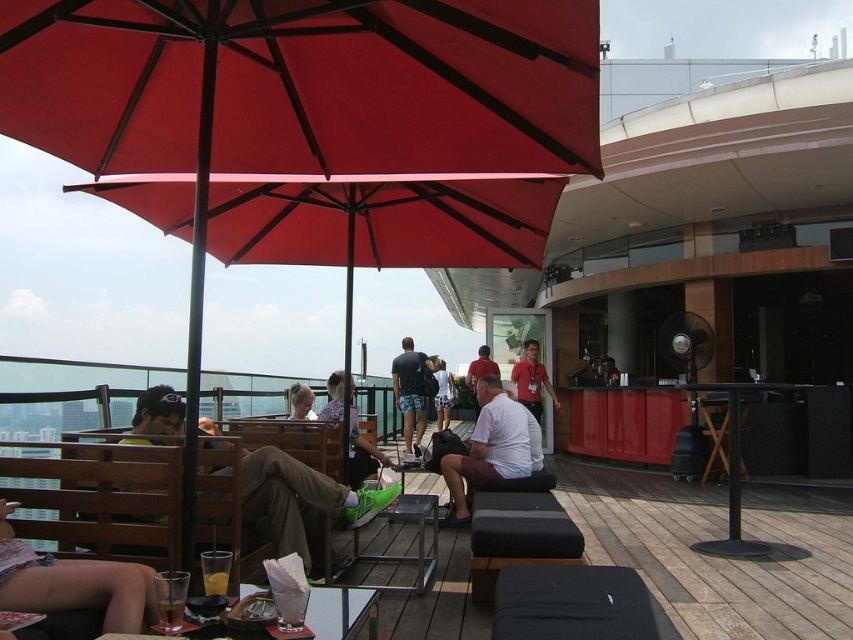
Identify the location of denim shorts at center. The height and width of the screenshot is (640, 853). (361, 451).

Does denim shorts at center have a lesser width compared to matte red shirt at center?

No, denim shorts at center is not thinner than matte red shirt at center.

Locate an element on the screen. denim shorts at center is located at coordinates (361, 451).

Is skinny jeans at lower left positioned behind red shirt at center?

No.

Looking at this image, between skinny jeans at lower left and red shirt at center, which one is positioned lower?

red shirt at center

What do you see at coordinates (73, 582) in the screenshot?
I see `skinny jeans at lower left` at bounding box center [73, 582].

Find the location of `skinny jeans at lower left`. skinny jeans at lower left is located at coordinates (73, 582).

Does white cotton shirt at center have a lesser height compared to matte red shirt at center?

Yes, white cotton shirt at center is shorter than matte red shirt at center.

Between white cotton shirt at center and matte red shirt at center, which one has less height?

Standing shorter between the two is white cotton shirt at center.

Locate an element on the screen. Image resolution: width=853 pixels, height=640 pixels. white cotton shirt at center is located at coordinates (486, 449).